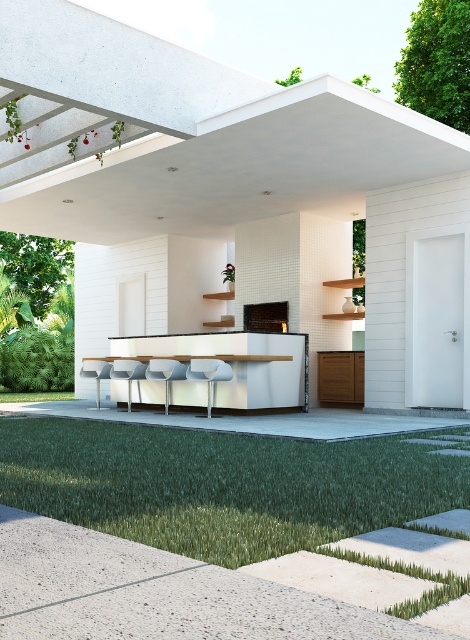
You are standing at the entrance of the outdoor kitchen area and want to know the position of the white concrete pergola at upper center. Based on the coordinates provided, can you determine its location relative to the center of the image?

The white concrete pergola at upper center is located at point coordinates of 0.294 on the x axis and 0.509 on the y axis, so it is positioned slightly to the left and above the center of the image.

You are designing a garden layout and need to know the spatial relationship between the white concrete pergola at upper center and the green grass at lower center. Which one is wider?

The white concrete pergola at upper center is wider than the green grass at lower center according to their widths.

You are standing in the modern outdoor kitchen area and want to place a potted plant between the white concrete pergola at upper center and the green grass at lower center. Based on their positions, which object should the potted plant be closer to?

The potted plant should be placed closer to the green grass at lower center since the white concrete pergola at upper center is positioned to the left of the green grass at lower center.